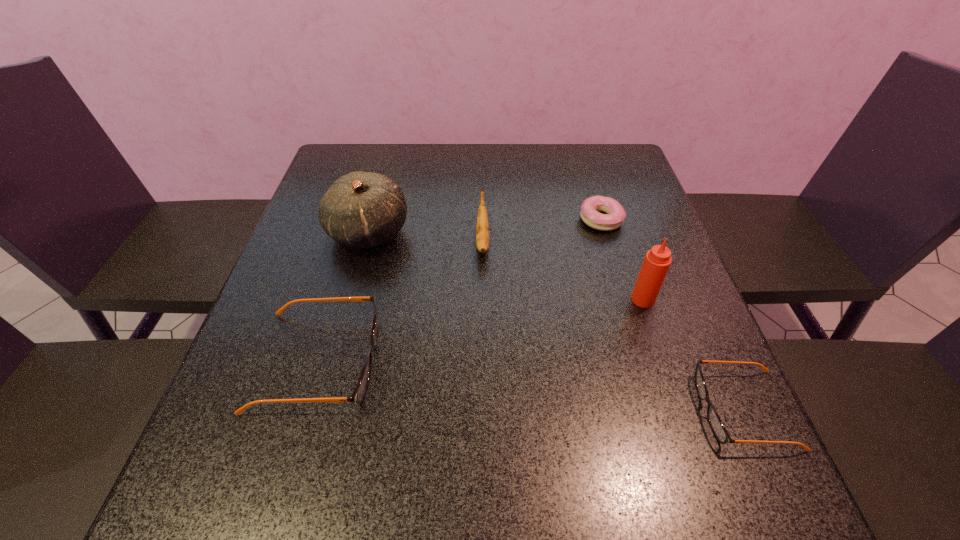
At what (x,y) coordinates should I click in order to perform the action: click on the left spectacles. Please return your answer as a coordinate pair (x, y). The image size is (960, 540). Looking at the image, I should click on (357, 396).

The height and width of the screenshot is (540, 960). Identify the location of the third shortest object. pos(357,396).

Locate an element on the screen. This screenshot has height=540, width=960. the rightmost object is located at coordinates (714, 420).

Find the location of a particular element. the shorter spectacles is located at coordinates (714, 420).

Where is `doughnut`? The width and height of the screenshot is (960, 540). doughnut is located at coordinates (591, 207).

Identify the location of gourd. This screenshot has height=540, width=960. (361, 209).

The width and height of the screenshot is (960, 540). Identify the location of the third object from left to right. (482, 229).

Where is `banana`? The image size is (960, 540). banana is located at coordinates 482,229.

Where is `the fourth farthest object`? This screenshot has height=540, width=960. the fourth farthest object is located at coordinates point(657,261).

Locate an element on the screen. The height and width of the screenshot is (540, 960). vacant space positioned 0.290m on the front-facing side of the taller spectacles is located at coordinates point(533,361).